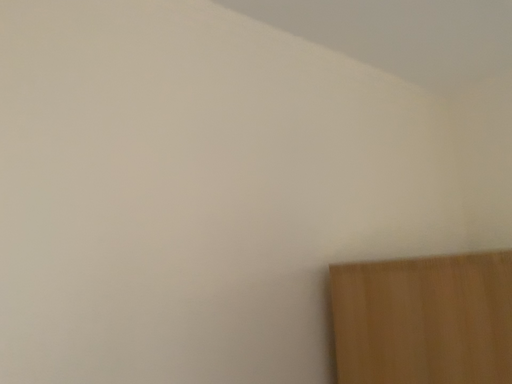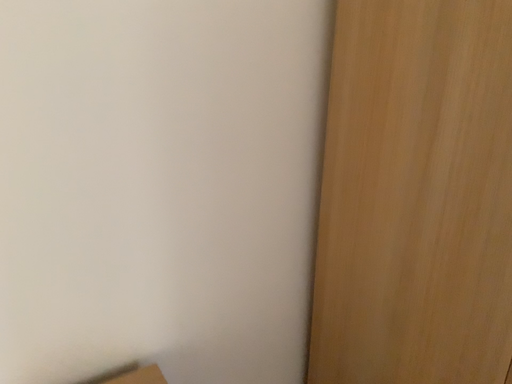
Question: How did the camera likely rotate when shooting the video?

Choices:
 (A) rotated downward
 (B) rotated upward

Answer: (A)